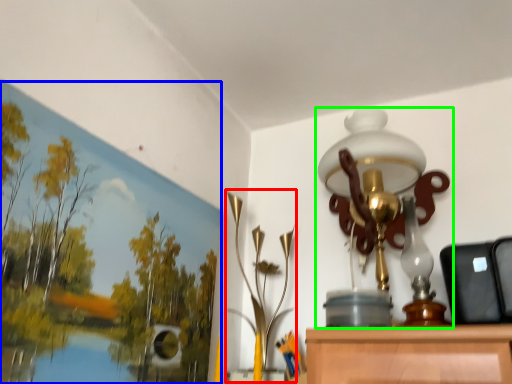
Question: Which is nearer to the lamp (highlighted by a red box)? oil painting (highlighted by a blue box) or lamp (highlighted by a green box).

Choices:
 (A) oil painting
 (B) lamp

Answer: (B)